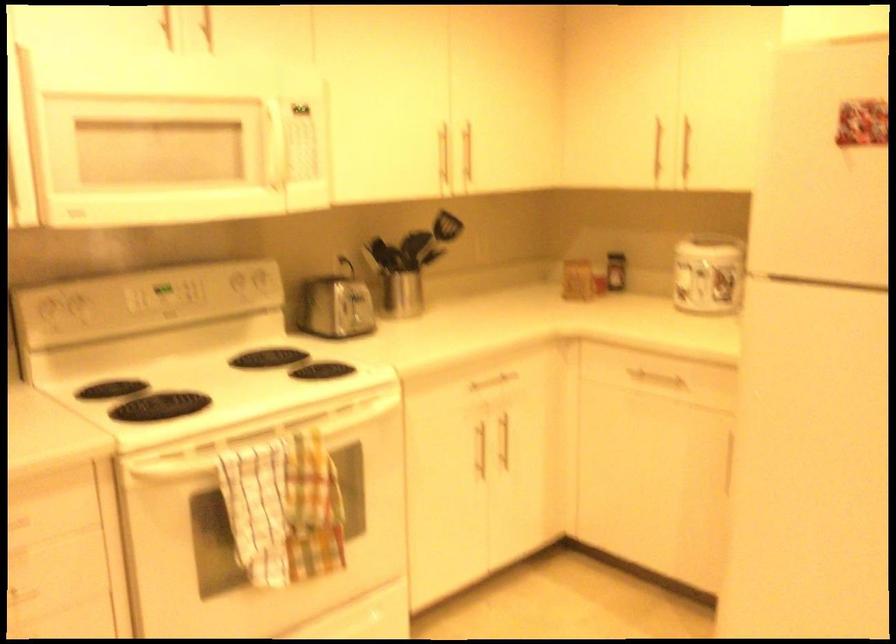
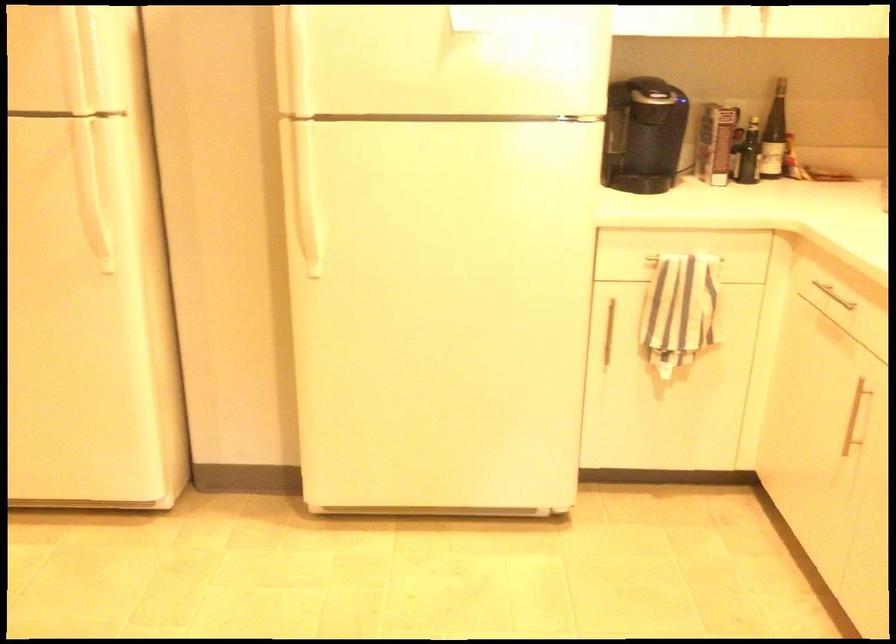
Question: The camera is either moving clockwise (left) or counter-clockwise (right) around the object. The first image is from the beginning of the video and the second image is from the end. Is the camera moving left or right when shooting the video?

Choices:
 (A) Left
 (B) Right

Answer: (A)